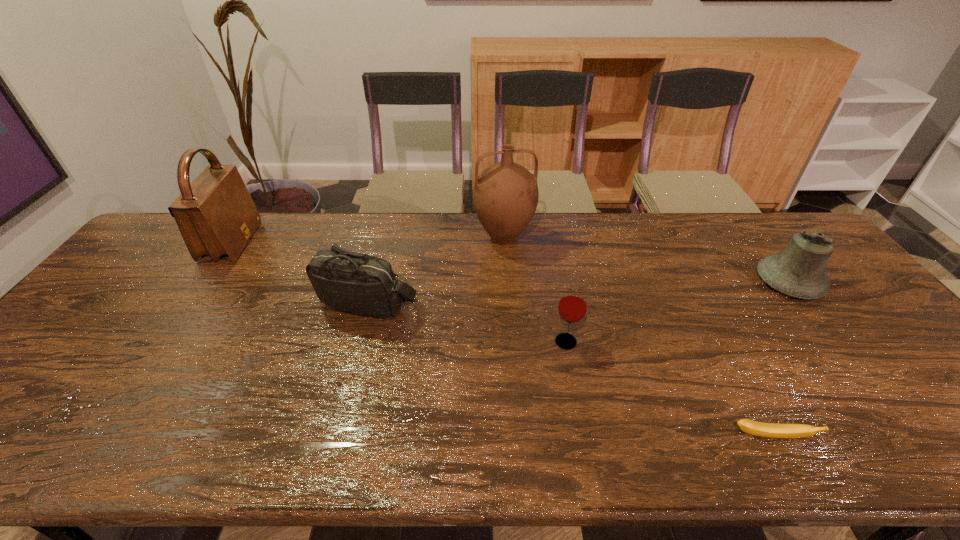
In order to click on pitcher in this screenshot , I will do `click(505, 196)`.

At what (x,y) coordinates should I click in order to perform the action: click on the leftmost object. Please return your answer as a coordinate pair (x, y). Image resolution: width=960 pixels, height=540 pixels. Looking at the image, I should click on (216, 216).

This screenshot has width=960, height=540. In order to click on the left shoulder bag in this screenshot , I will do `click(216, 216)`.

Where is `the right shoulder bag`? This screenshot has height=540, width=960. the right shoulder bag is located at coordinates (350, 282).

Where is `the fifth object from right to left`? This screenshot has height=540, width=960. the fifth object from right to left is located at coordinates (350, 282).

At what (x,y) coordinates should I click in order to perform the action: click on bell. Please return your answer as a coordinate pair (x, y). The width and height of the screenshot is (960, 540). Looking at the image, I should click on [798, 270].

Where is `the fifth farthest object`? The image size is (960, 540). the fifth farthest object is located at coordinates (572, 306).

This screenshot has width=960, height=540. I want to click on the third object from right to left, so click(572, 306).

This screenshot has width=960, height=540. I want to click on the nearest object, so (x=774, y=430).

The height and width of the screenshot is (540, 960). In order to click on the second object from right to left in this screenshot , I will do `click(774, 430)`.